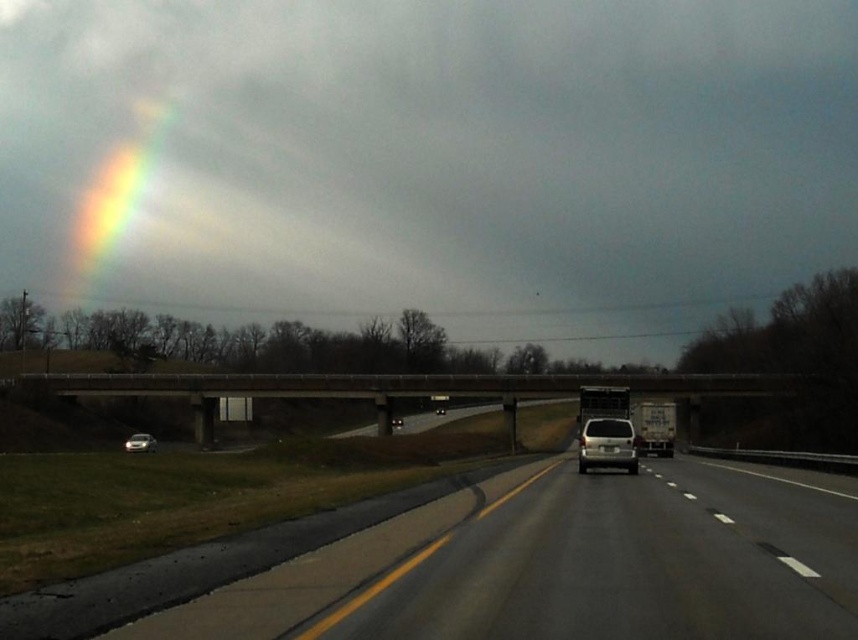
You are standing at the side of the highway and see two points marked on the road ahead. The first point is at coordinates point (x=137, y=449) and the second is at point (x=440, y=413). Which point is closer to your current position?

Point (x=137, y=449) is closer to the camera than point (x=440, y=413), so the first point is closer to your current position.

You are a drone operator trying to capture a photo of two specific points on the highway. The first point is labeled as point [85,236] and the second is point [437,408]. Based on the scene description, which point is closer to the camera when you take the photo?

Point [85,236] is closer to the camera because it is further to the viewer than point [437,408].

You are a pedestrian waiting to cross the road. You see a shiny silver car at lower left and a matte white sedan at center. Which vehicle is closer to you?

The shiny silver car at lower left is closer to you since it is only 60.09 meters away from the matte white sedan at center, but without knowing the exact distance from you, we can infer that the one at lower left is closer based on typical perspective in images.